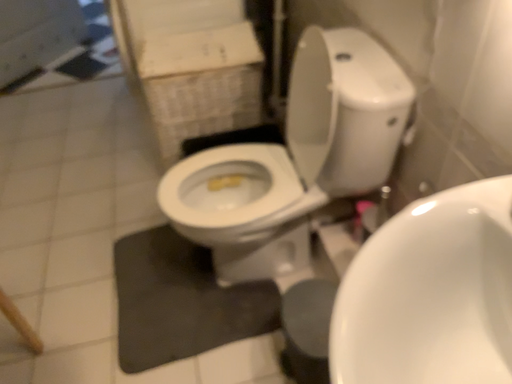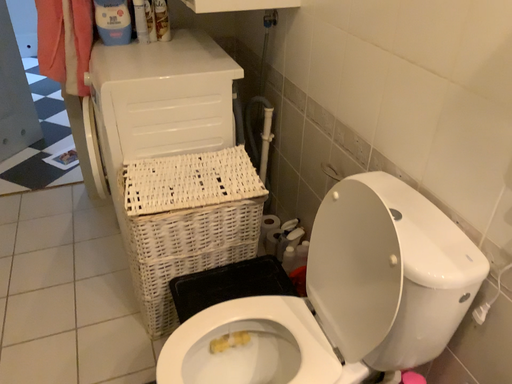
Question: How did the camera likely rotate when shooting the video?

Choices:
 (A) rotated right
 (B) rotated left

Answer: (A)